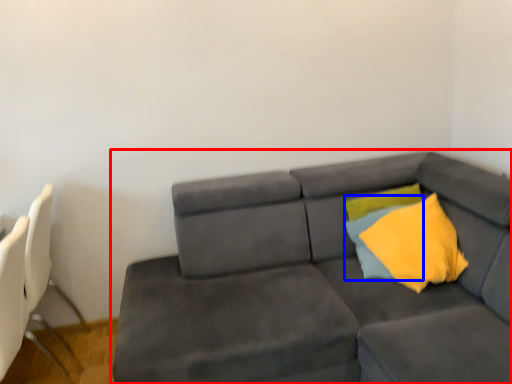
Question: Which object is closer to the camera taking this photo, studio couch (highlighted by a red box) or pillow (highlighted by a blue box)?

Choices:
 (A) studio couch
 (B) pillow

Answer: (A)